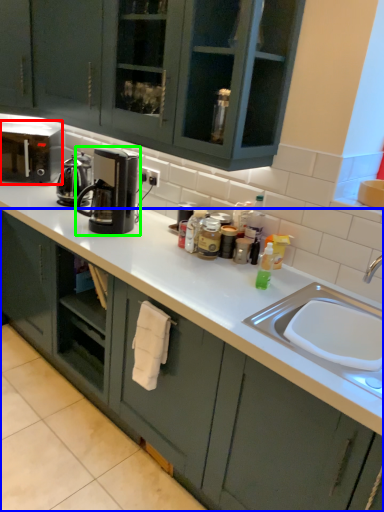
Question: Which is nearer to the home appliance (highlighted by a red box)? cabinetry (highlighted by a blue box) or kitchen appliance (highlighted by a green box).

Choices:
 (A) cabinetry
 (B) kitchen appliance

Answer: (B)